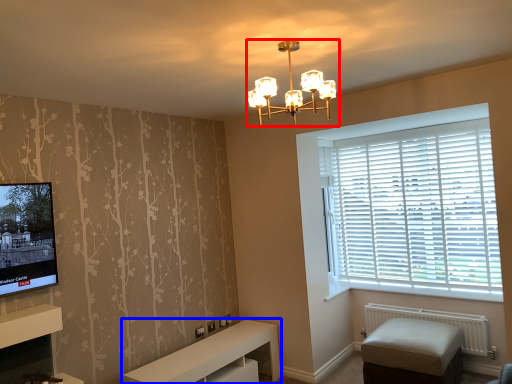
Question: Which object appears farthest to the camera in this image, lamp (highlighted by a red box) or furniture (highlighted by a blue box)?

Choices:
 (A) lamp
 (B) furniture

Answer: (B)